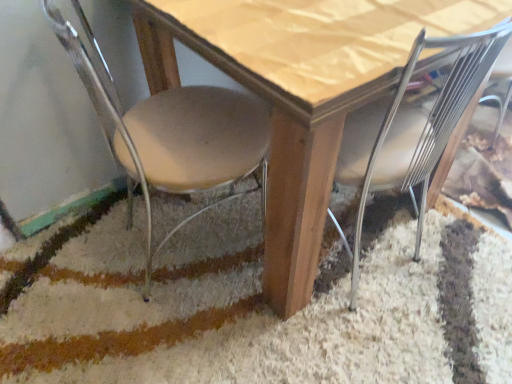
Question: Can you see metallic silver chair at lower right, the second chair when ordered from left to right, touching wooden table at center?

Choices:
 (A) no
 (B) yes

Answer: (A)

Question: From the image's perspective, would you say metallic silver chair at lower right, positioned as the first chair in right-to-left order, is shown under wooden table at center?

Choices:
 (A) no
 (B) yes

Answer: (B)

Question: Considering the relative positions of metallic silver chair at lower right, positioned as the first chair in right-to-left order, and wooden table at center in the image provided, is metallic silver chair at lower right, positioned as the first chair in right-to-left order, to the left of wooden table at center from the viewer's perspective?

Choices:
 (A) no
 (B) yes

Answer: (A)

Question: Can you confirm if metallic silver chair at lower right, positioned as the first chair in right-to-left order, is thinner than wooden table at center?

Choices:
 (A) no
 (B) yes

Answer: (B)

Question: Considering the relative positions of metallic silver chair at lower right, positioned as the first chair in right-to-left order, and wooden table at center in the image provided, is metallic silver chair at lower right, positioned as the first chair in right-to-left order, to the right of wooden table at center from the viewer's perspective?

Choices:
 (A) no
 (B) yes

Answer: (B)

Question: From a real-world perspective, is metallic silver chair at lower right, positioned as the first chair in right-to-left order, above or below beige fabric chair at lower left, acting as the second chair starting from the right?

Choices:
 (A) below
 (B) above

Answer: (B)

Question: Does point (448, 125) appear closer or farther from the camera than point (266, 119)?

Choices:
 (A) farther
 (B) closer

Answer: (B)

Question: Looking at their shapes, would you say metallic silver chair at lower right, positioned as the first chair in right-to-left order, is wider or thinner than beige fabric chair at lower left, acting as the second chair starting from the right?

Choices:
 (A) thin
 (B) wide

Answer: (A)

Question: From the image's perspective, is metallic silver chair at lower right, positioned as the first chair in right-to-left order, located above or below beige fabric chair at lower left, acting as the second chair starting from the right?

Choices:
 (A) below
 (B) above

Answer: (A)

Question: Based on their sizes in the image, would you say beige fabric chair at lower left, the 1th chair in the left-to-right sequence, is bigger or smaller than wooden table at center?

Choices:
 (A) small
 (B) big

Answer: (A)

Question: From a real-world perspective, relative to wooden table at center, is beige fabric chair at lower left, acting as the second chair starting from the right, vertically above or below?

Choices:
 (A) below
 (B) above

Answer: (B)

Question: Relative to wooden table at center, is beige fabric chair at lower left, acting as the second chair starting from the right, in front or behind?

Choices:
 (A) behind
 (B) front

Answer: (B)

Question: From the image's perspective, relative to wooden table at center, is beige fabric chair at lower left, acting as the second chair starting from the right, above or below?

Choices:
 (A) below
 (B) above

Answer: (A)

Question: Considering the relative positions of beige fabric chair at lower left, the 1th chair in the left-to-right sequence, and metallic silver chair at lower right, the second chair when ordered from left to right, in the image provided, is beige fabric chair at lower left, the 1th chair in the left-to-right sequence, to the left or to the right of metallic silver chair at lower right, the second chair when ordered from left to right,?

Choices:
 (A) left
 (B) right

Answer: (A)

Question: Relative to metallic silver chair at lower right, the second chair when ordered from left to right, is beige fabric chair at lower left, the 1th chair in the left-to-right sequence, in front or behind?

Choices:
 (A) front
 (B) behind

Answer: (A)